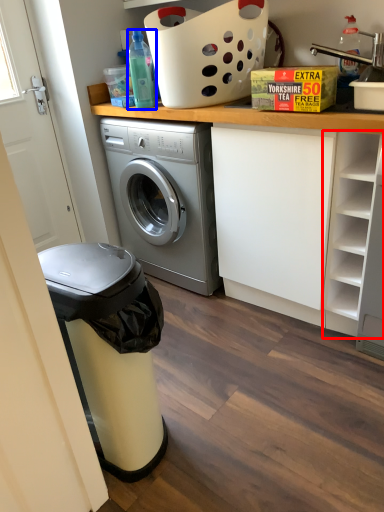
Question: Which point is closer to the camera, shelf (highlighted by a red box) or bottle (highlighted by a blue box)?

Choices:
 (A) shelf
 (B) bottle

Answer: (A)